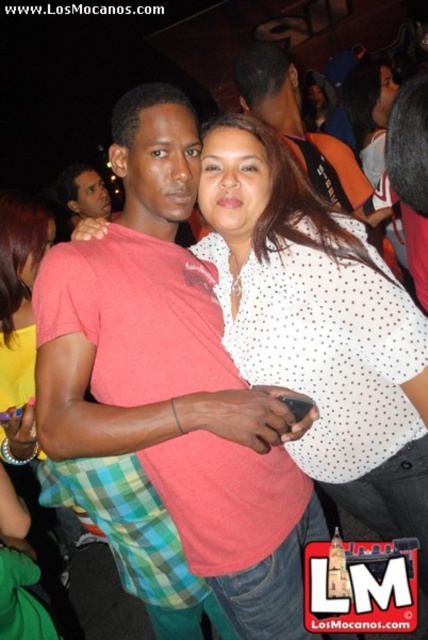
Between pink cotton shirt at center and yellow fabric shirt at left, which one has less height?

With less height is yellow fabric shirt at left.

Can you confirm if pink cotton shirt at center is positioned above yellow fabric shirt at left?

No, pink cotton shirt at center is not above yellow fabric shirt at left.

Locate an element on the screen. The width and height of the screenshot is (428, 640). pink cotton shirt at center is located at coordinates (174, 378).

Is yellow fabric shirt at left bigger than matte black shirt at upper left?

No, yellow fabric shirt at left is not bigger than matte black shirt at upper left.

Which of these two, yellow fabric shirt at left or matte black shirt at upper left, stands taller?

With more height is yellow fabric shirt at left.

Where is `yellow fabric shirt at left`? yellow fabric shirt at left is located at coordinates (20, 321).

Does pink cotton shirt at center have a greater height compared to matte black shirt at upper left?

Correct, pink cotton shirt at center is much taller as matte black shirt at upper left.

Which is in front, point (184, 388) or point (86, 170)?

Point (184, 388) is more forward.

In the scene shown: Who is more distant from viewer, (x=92, y=362) or (x=106, y=205)?

Point (x=106, y=205)

The image size is (428, 640). I want to click on pink cotton shirt at center, so click(174, 378).